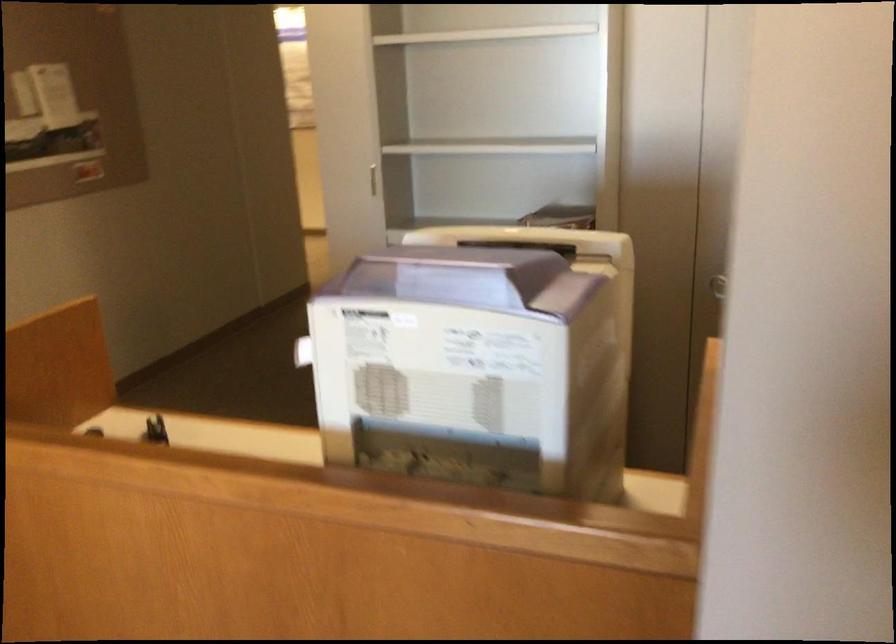
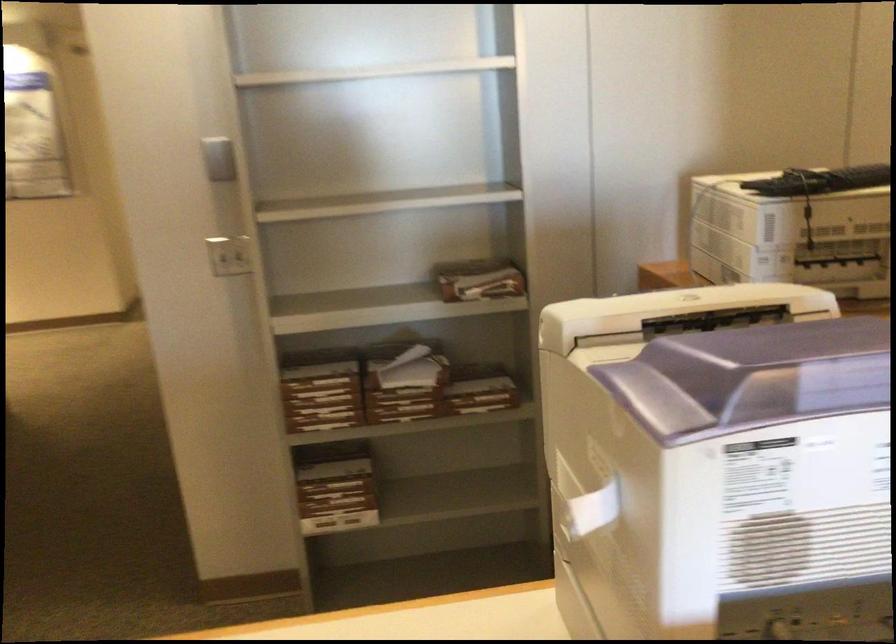
Where in the second image is the point corresponding to pixel 392 259 from the first image?

(780, 368)